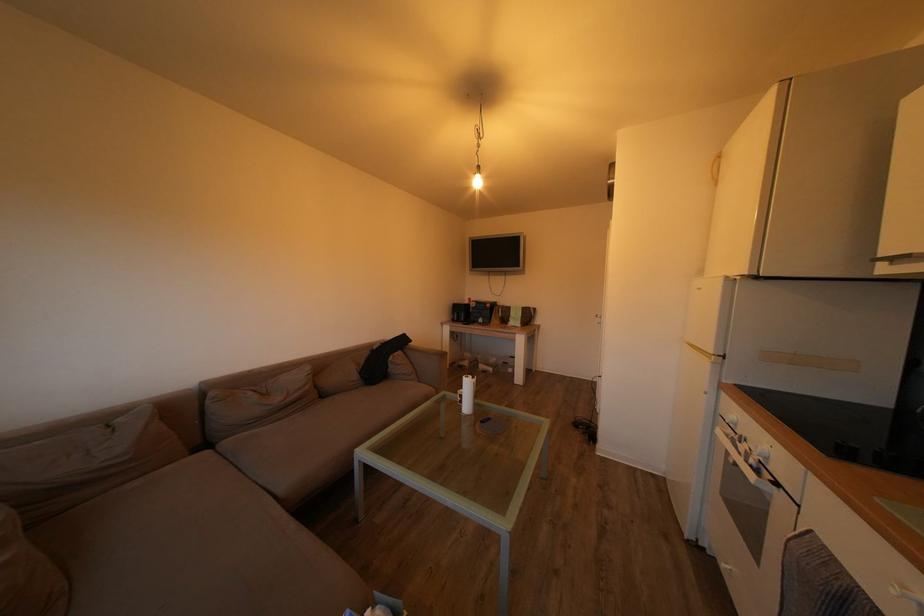
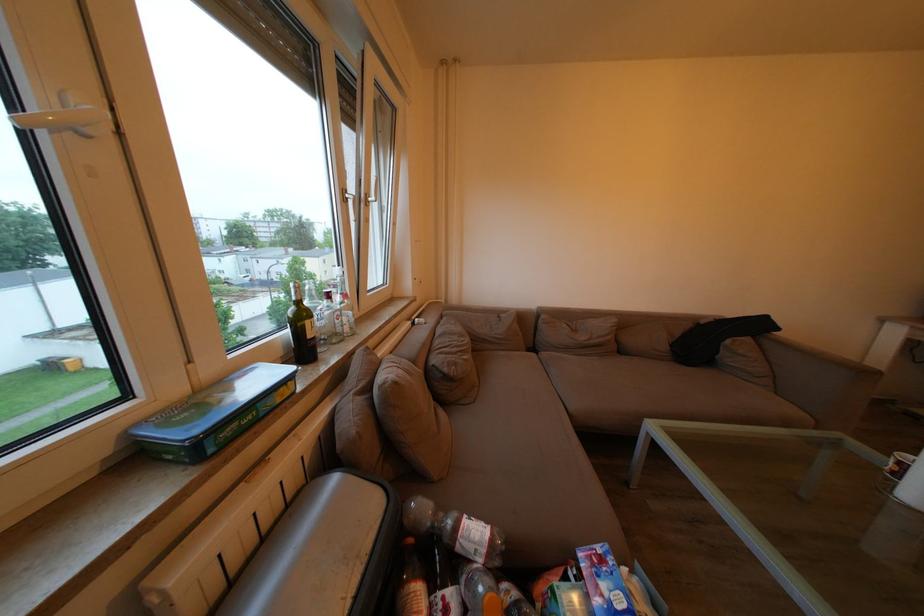
Find the pixel in the second image that matches point 331,402 in the first image.

(629, 358)